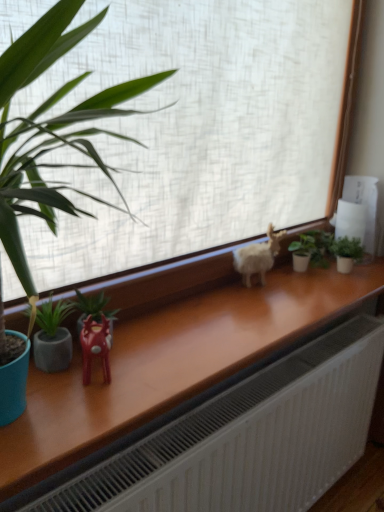
What do you see at coordinates (199, 129) in the screenshot? I see `white matte window at center` at bounding box center [199, 129].

What do you see at coordinates (95, 346) in the screenshot? I see `shiny red plastic reindeer at center-left` at bounding box center [95, 346].

Describe the element at coordinates (311, 249) in the screenshot. The width and height of the screenshot is (384, 512). I see `green matte plant at center-right, the first houseplant positioned from the back` at that location.

The height and width of the screenshot is (512, 384). What do you see at coordinates (94, 310) in the screenshot?
I see `green matte houseplant at center, arranged as the second houseplant when viewed from the front` at bounding box center [94, 310].

Identify the location of white fluffy goat at center. Image resolution: width=384 pixels, height=512 pixels. click(x=258, y=257).

Is green matte plant at right, which is the 3th houseplant from front to back, further to camera compared to green matte plant at center-right, which ranks as the third houseplant in left-to-right order?

No, it is not.

Is green matte plant at right, the fourth houseplant in the left-to-right sequence, completely or partially outside of green matte plant at center-right, which is the 2th houseplant from right to left?

That's correct, green matte plant at right, the fourth houseplant in the left-to-right sequence, is outside of green matte plant at center-right, which is the 2th houseplant from right to left.

Find the location of `houseplant below the green matte plant at right, acting as the second houseplant starting from the back (from a real-world perspective)`. houseplant below the green matte plant at right, acting as the second houseplant starting from the back (from a real-world perspective) is located at coordinates (311, 249).

From the image's perspective, is shiny red plastic reindeer at center-left beneath green matte plant at left, marked as the 1th houseplant in a front-to-back arrangement?

Yes, from the image's perspective, shiny red plastic reindeer at center-left is beneath green matte plant at left, marked as the 1th houseplant in a front-to-back arrangement.

Locate an element on the screen. Image resolution: width=384 pixels, height=512 pixels. the 2nd houseplant to the left of the shiny red plastic reindeer at center-left, counting from the anchor's position is located at coordinates (52, 337).

Is the depth of shiny red plastic reindeer at center-left less than that of green matte plant at left, marked as the 1th houseplant in a front-to-back arrangement?

Yes, shiny red plastic reindeer at center-left is in front of green matte plant at left, marked as the 1th houseplant in a front-to-back arrangement.

Considering the relative positions of shiny red plastic reindeer at center-left and green matte plant at left, the fourth houseplant positioned from the right, in the image provided, is shiny red plastic reindeer at center-left to the right of green matte plant at left, the fourth houseplant positioned from the right, from the viewer's perspective?

Yes.

Considering the sizes of green matte plant at center-right, positioned as the 4th houseplant in front-to-back order, and white fluffy goat at center in the image, is green matte plant at center-right, positioned as the 4th houseplant in front-to-back order, bigger or smaller than white fluffy goat at center?

Considering their sizes, green matte plant at center-right, positioned as the 4th houseplant in front-to-back order, takes up less space than white fluffy goat at center.

Considering the positions of objects green matte plant at center-right, which ranks as the third houseplant in left-to-right order, and white fluffy goat at center in the image provided, who is behind, green matte plant at center-right, which ranks as the third houseplant in left-to-right order, or white fluffy goat at center?

Positioned behind is green matte plant at center-right, which ranks as the third houseplant in left-to-right order.

Is point (316, 251) positioned after point (246, 268)?

Yes, it is behind point (246, 268).

From the image's perspective, which is below, green matte plant at center-right, which ranks as the third houseplant in left-to-right order, or white fluffy goat at center?

white fluffy goat at center, from the image's perspective.

Which is closer, (x=87, y=377) or (x=249, y=287)?

Point (x=87, y=377) is positioned closer to the camera compared to point (x=249, y=287).

Could you tell me if shiny red plastic reindeer at center-left is turned towards white fluffy goat at center?

No.

From a real-world perspective, is shiny red plastic reindeer at center-left under white fluffy goat at center?

Yes, from a real-world perspective, shiny red plastic reindeer at center-left is under white fluffy goat at center.

Which is closer to the camera, (55, 337) or (93, 306)?

The point (55, 337) is closer to the camera.

From the image's perspective, who appears lower, green matte plant at left, marked as the 1th houseplant in a front-to-back arrangement, or green matte houseplant at center, which appears as the third houseplant when viewed from the right?

green matte plant at left, marked as the 1th houseplant in a front-to-back arrangement, appears lower in the image.

From the picture: Which of these two, green matte plant at left, which is counted as the 1th houseplant, starting from the left, or green matte houseplant at center, arranged as the second houseplant when viewed from the front, is thinner?

green matte plant at left, which is counted as the 1th houseplant, starting from the left, is thinner.

Can you confirm if white fluffy goat at center is wider than green matte plant at center-right, which is the 2th houseplant from right to left?

No.

Looking at this image, from a real-world perspective, which is physically below, white fluffy goat at center or green matte plant at center-right, which is the 2th houseplant from right to left?

green matte plant at center-right, which is the 2th houseplant from right to left.

Does point (112, 319) appear closer or farther from the camera than point (139, 256)?

Point (112, 319).

In the image, is green matte houseplant at center, arranged as the third houseplant when viewed from the back, positioned in front of or behind white matte window at center?

Visually, green matte houseplant at center, arranged as the third houseplant when viewed from the back, is located behind white matte window at center.

Does green matte houseplant at center, which appears as the third houseplant when viewed from the right, appear on the right side of white matte window at center?

No, green matte houseplant at center, which appears as the third houseplant when viewed from the right, is not to the right of white matte window at center.

In the image, there is a green matte plant at right, acting as the second houseplant starting from the back. Find the location of `houseplant above it (from the image's perspective)`. houseplant above it (from the image's perspective) is located at coordinates (311, 249).

Locate an element on the screen. The image size is (384, 512). the 1st houseplant behind the shiny red plastic reindeer at center-left is located at coordinates (52, 337).

Which object lies further to the anchor point shiny red plastic reindeer at center-left, green matte plant at left, the fourth houseplant positioned from the right, or white matte window at center?

white matte window at center is further to shiny red plastic reindeer at center-left.

From the image, which object appears to be nearer to green matte plant at left, marked as the 1th houseplant in a front-to-back arrangement, white matte window at center or green matte plant at right, acting as the second houseplant starting from the back?

white matte window at center.

Looking at the image, which one is located closer to white matte window at center, shiny red plastic reindeer at center-left or green matte plant at left, marked as the 1th houseplant in a front-to-back arrangement?

The object closer to white matte window at center is green matte plant at left, marked as the 1th houseplant in a front-to-back arrangement.

Based on the photo, based on their spatial positions, is green matte plant at right, acting as the second houseplant starting from the back, or shiny red plastic reindeer at center-left further from green matte houseplant at center, arranged as the second houseplant when viewed from the front?

green matte plant at right, acting as the second houseplant starting from the back.

Looking at the image, which one is located closer to green matte houseplant at center, which is counted as the second houseplant, starting from the left, green matte plant at right, the fourth houseplant in the left-to-right sequence, or green matte plant at center-right, positioned as the 4th houseplant in front-to-back order?

Among the two, green matte plant at center-right, positioned as the 4th houseplant in front-to-back order, is located nearer to green matte houseplant at center, which is counted as the second houseplant, starting from the left.

Looking at the image, which one is located further to shiny red plastic reindeer at center-left, green matte plant at right, which is the 3th houseplant from front to back, or green matte houseplant at center, which is counted as the second houseplant, starting from the left?

green matte plant at right, which is the 3th houseplant from front to back, lies further to shiny red plastic reindeer at center-left than the other object.

Based on their spatial positions, is white matte window at center or white fluffy goat at center closer to green matte plant at left, placed as the 4th houseplant when sorted from back to front?

white matte window at center is closer to green matte plant at left, placed as the 4th houseplant when sorted from back to front.

Based on their spatial positions, is green matte houseplant at center, which appears as the third houseplant when viewed from the right, or green matte plant at center-right, the first houseplant positioned from the back, further from green matte plant at left, which is counted as the 1th houseplant, starting from the left?

Among the two, green matte plant at center-right, the first houseplant positioned from the back, is located further to green matte plant at left, which is counted as the 1th houseplant, starting from the left.

Locate an element on the screen. The height and width of the screenshot is (512, 384). animal between white matte window at center and green matte plant at right, the fourth houseplant in the left-to-right sequence, in the front-back direction is located at coordinates (258, 257).

Where is `houseplant situated between green matte plant at left, which is counted as the 1th houseplant, starting from the left, and white fluffy goat at center from left to right`? houseplant situated between green matte plant at left, which is counted as the 1th houseplant, starting from the left, and white fluffy goat at center from left to right is located at coordinates (94, 310).

Where is `houseplant between white matte window at center and green matte houseplant at center, which appears as the third houseplant when viewed from the right, from front to back`? The height and width of the screenshot is (512, 384). houseplant between white matte window at center and green matte houseplant at center, which appears as the third houseplant when viewed from the right, from front to back is located at coordinates (52, 337).

Image resolution: width=384 pixels, height=512 pixels. Find the location of `houseplant between green matte houseplant at center, arranged as the third houseplant when viewed from the back, and green matte plant at right, acting as the second houseplant starting from the back, in the horizontal direction`. houseplant between green matte houseplant at center, arranged as the third houseplant when viewed from the back, and green matte plant at right, acting as the second houseplant starting from the back, in the horizontal direction is located at coordinates (311, 249).